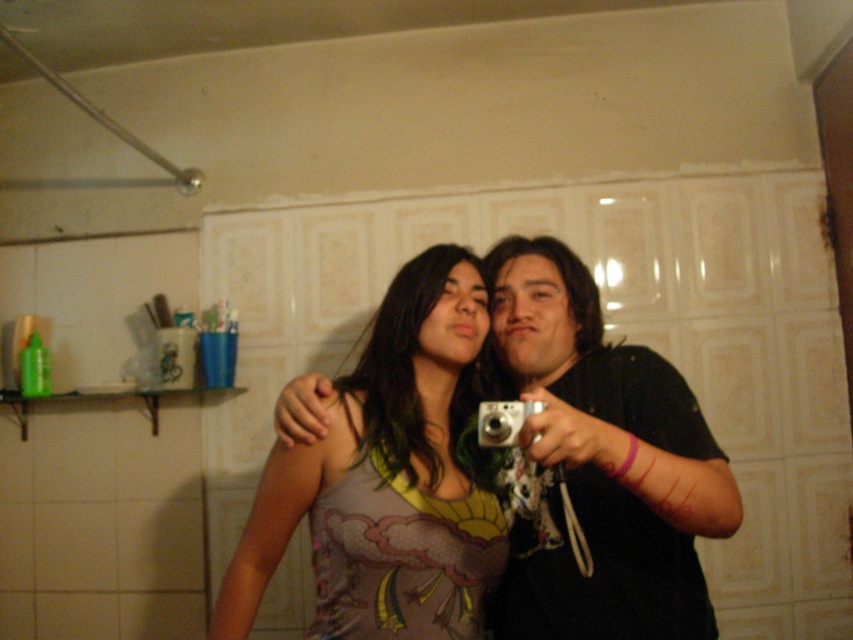
Between black matte camera at center and silver metallic camera at center, which one appears on the right side from the viewer's perspective?

From the viewer's perspective, black matte camera at center appears more on the right side.

Does black matte camera at center appear on the left side of silver metallic camera at center?

In fact, black matte camera at center is to the right of silver metallic camera at center.

Is point (572, 256) positioned after point (509, 404)?

Yes, point (572, 256) is behind point (509, 404).

The image size is (853, 640). Identify the location of black matte camera at center. (602, 461).

Is matte fabric tank top at center wider than silver metallic camera at center?

Yes.

Can you confirm if matte fabric tank top at center is positioned below silver metallic camera at center?

Yes, matte fabric tank top at center is below silver metallic camera at center.

What do you see at coordinates (387, 477) in the screenshot? The image size is (853, 640). I see `matte fabric tank top at center` at bounding box center [387, 477].

You are a GUI agent. You are given a task and a screenshot of the screen. Output one action in this format:
    pyautogui.click(x=<x>, y=<y>)
    Task: Click on the matte fabric tank top at center
    This screenshot has width=853, height=640.
    Given the screenshot: What is the action you would take?
    tap(387, 477)

Can you confirm if matte fabric tank top at center is wider than black matte camera at center?

Indeed, matte fabric tank top at center has a greater width compared to black matte camera at center.

Is point (425, 545) positioned behind point (643, 346)?

No.

The height and width of the screenshot is (640, 853). In order to click on matte fabric tank top at center in this screenshot , I will do `click(387, 477)`.

The image size is (853, 640). In order to click on matte fabric tank top at center in this screenshot , I will do `click(387, 477)`.